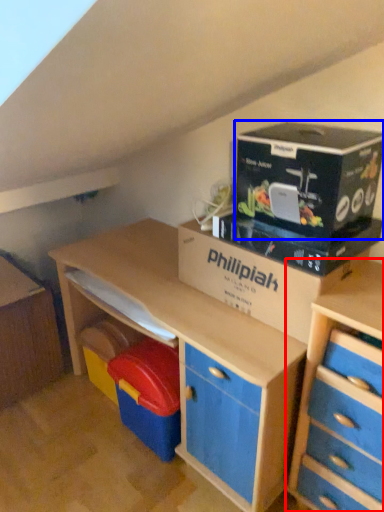
Question: Which object appears farthest to the camera in this image, chest of drawers (highlighted by a red box) or cardboard (highlighted by a blue box)?

Choices:
 (A) chest of drawers
 (B) cardboard

Answer: (B)